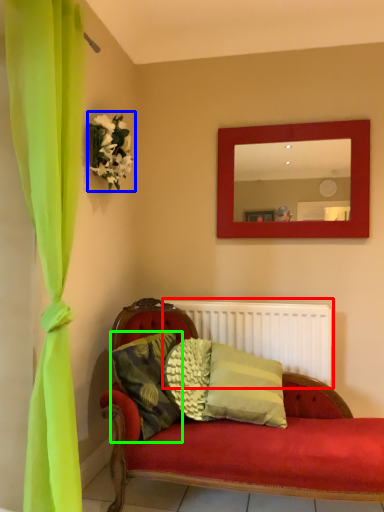
Question: Estimate the real-world distances between objects in this image. Which object is farther from radiator (highlighted by a red box), floral arrangement (highlighted by a blue box) or pillow (highlighted by a green box)?

Choices:
 (A) floral arrangement
 (B) pillow

Answer: (A)